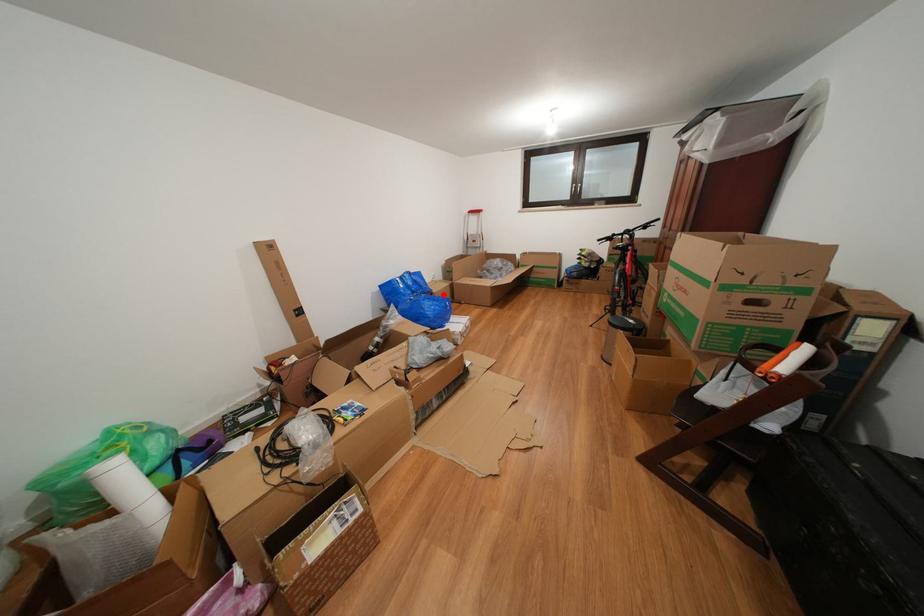
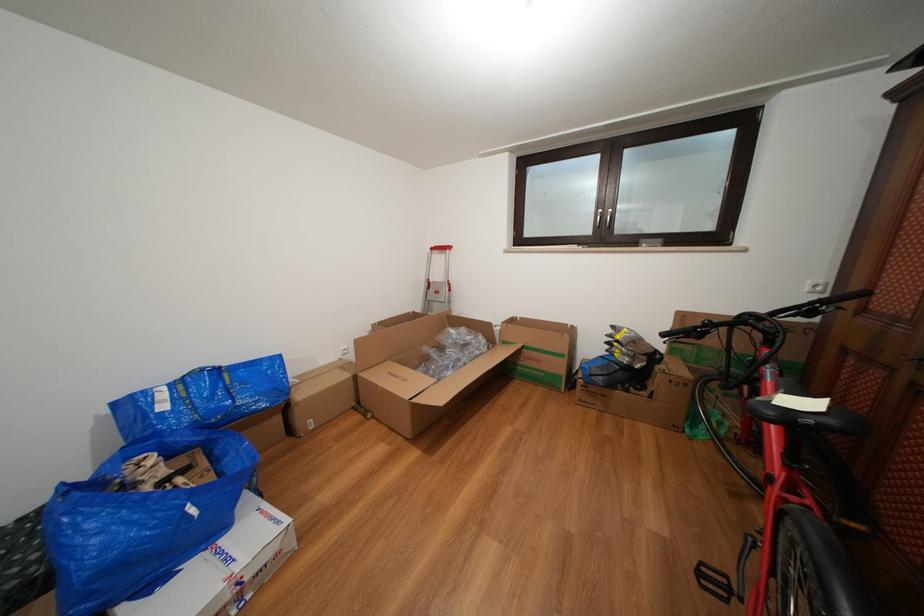
Question: I am providing you with two images of the same scene from different viewpoints. Given a red point in image1, look at the same physical point in image2. Is it:

Choices:
 (A) Closer to the viewpoint
 (B) Farther from the viewpoint

Answer: (B)